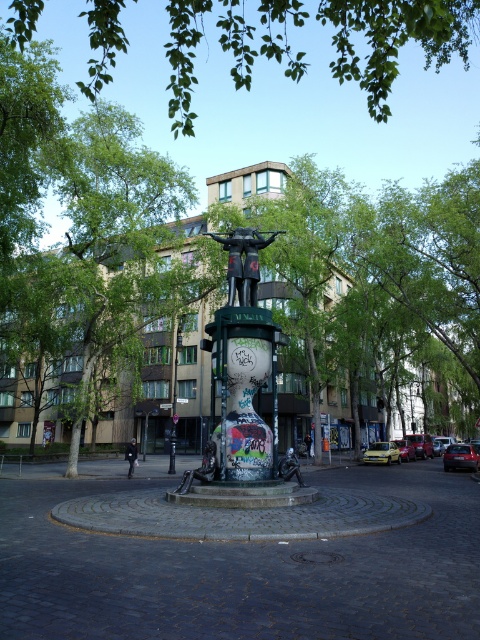
Is green leafy branches at upper center smaller than yellow matte car at center?

No, green leafy branches at upper center is not smaller than yellow matte car at center.

Can you confirm if green leafy branches at upper center is positioned to the right of yellow matte car at center?

In fact, green leafy branches at upper center is to the left of yellow matte car at center.

In the scene shown: Who is more distant from viewer, (88, 24) or (407, 451)?

The point (88, 24) is behind.

Image resolution: width=480 pixels, height=640 pixels. I want to click on green leafy branches at upper center, so click(x=394, y=38).

Is point (259, 472) positioned in front of point (411, 456)?

Yes, point (259, 472) is in front of point (411, 456).

Does graffiti-covered metal sculpture at center have a larger size compared to yellow matte car at center?

Yes.

Between point (225, 449) and point (406, 460), which one is positioned behind?

Point (406, 460)

Find the location of `graffiti-covered metal sculpture at center`. graffiti-covered metal sculpture at center is located at coordinates (241, 396).

Does black matte sculpture at center appear on the right side of yellow matte car at center?

No, black matte sculpture at center is not to the right of yellow matte car at center.

Who is taller, black matte sculpture at center or yellow matte car at center?

yellow matte car at center is taller.

Who is more forward, (248, 256) or (408, 460)?

Positioned in front is point (248, 256).

Where is `black matte sculpture at center`? black matte sculpture at center is located at coordinates (242, 260).